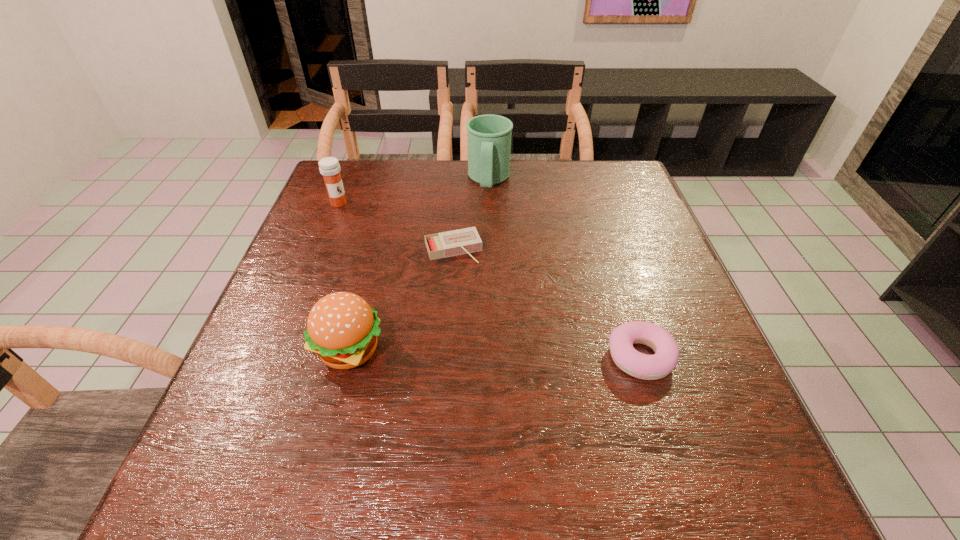
At what (x,y) coordinates should I click in order to perform the action: click on free space at the near right corner of the desktop. Please return your answer as a coordinate pair (x, y). The width and height of the screenshot is (960, 540). Looking at the image, I should click on (724, 406).

Identify the location of empty location between the hamburger and the third farthest object. This screenshot has width=960, height=540. (402, 299).

I want to click on free space between the third nearest object and the second shortest object, so click(x=547, y=303).

Locate an element on the screen. Image resolution: width=960 pixels, height=540 pixels. empty location between the medicine and the mug is located at coordinates (414, 192).

You are a GUI agent. You are given a task and a screenshot of the screen. Output one action in this format:
    pyautogui.click(x=<x>, y=<y>)
    Task: Click on the vacant area that lies between the matchbox and the mug
    
    Given the screenshot: What is the action you would take?
    pyautogui.click(x=471, y=214)

Identify the location of free spot between the shortest object and the leftmost object. (396, 226).

Identify the location of vacant space that is in between the second object from left to right and the mug. The image size is (960, 540). (420, 265).

Locate an element on the screen. Image resolution: width=960 pixels, height=540 pixels. vacant area between the mug and the rightmost object is located at coordinates (564, 268).

Locate an element on the screen. free space between the mug and the third farthest object is located at coordinates pos(471,214).

Identify the location of empty location between the rightmost object and the shortest object. (547, 303).